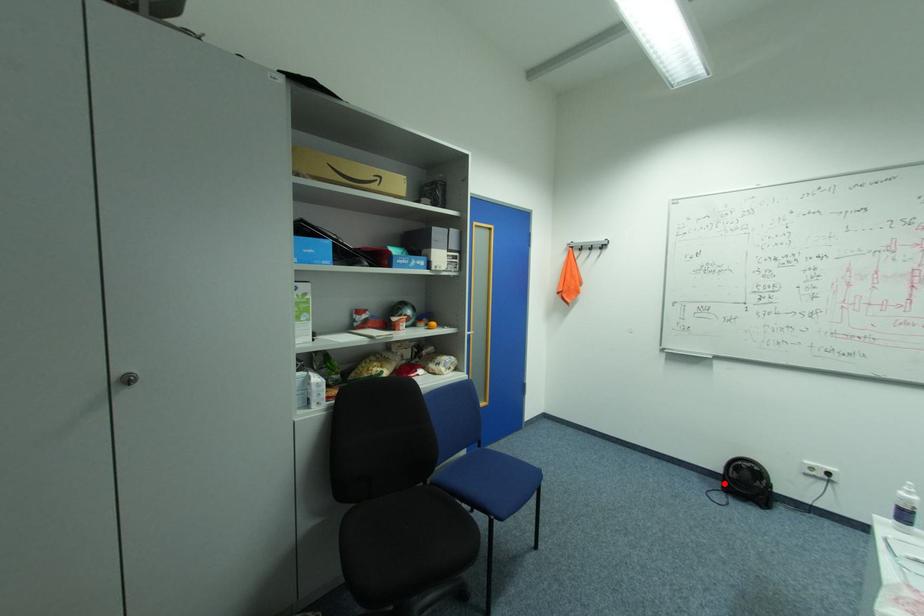
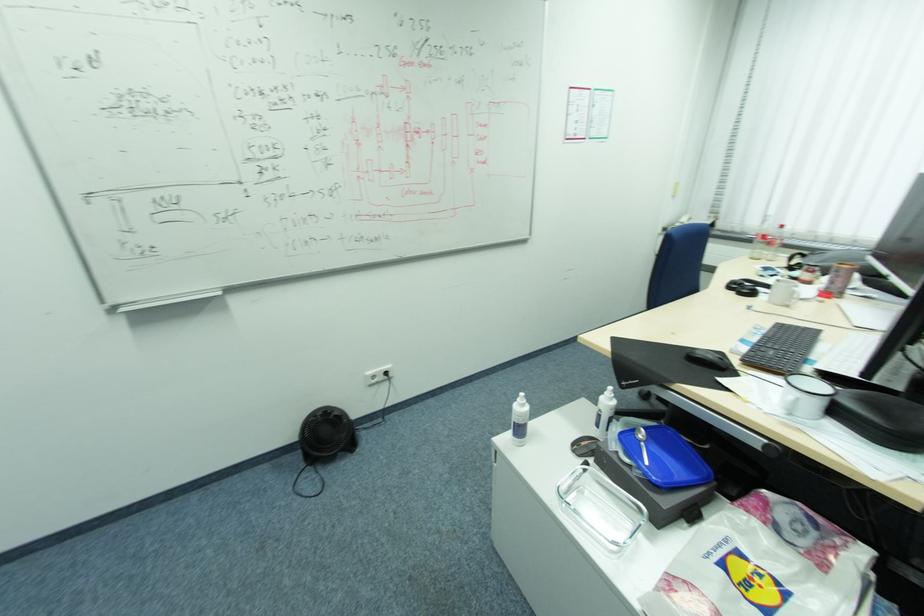
Find the pixel in the second image that matches the highlighted location in the first image.

(304, 456)